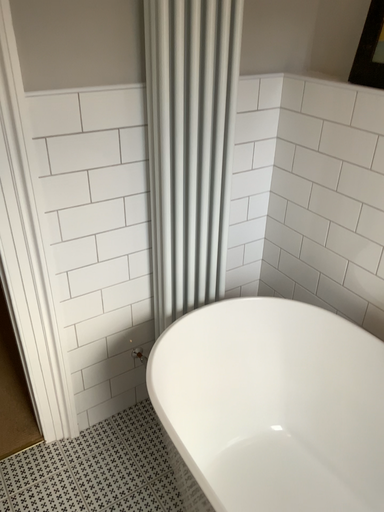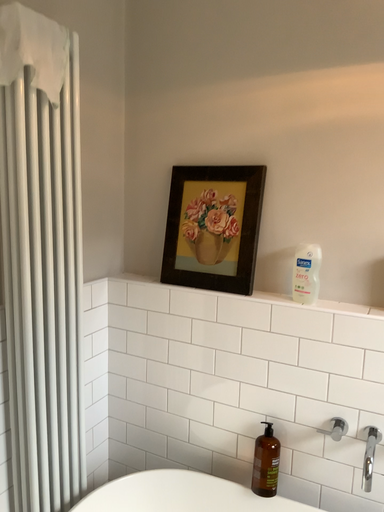
Question: Which way did the camera rotate in the video?

Choices:
 (A) rotated right
 (B) rotated left

Answer: (A)